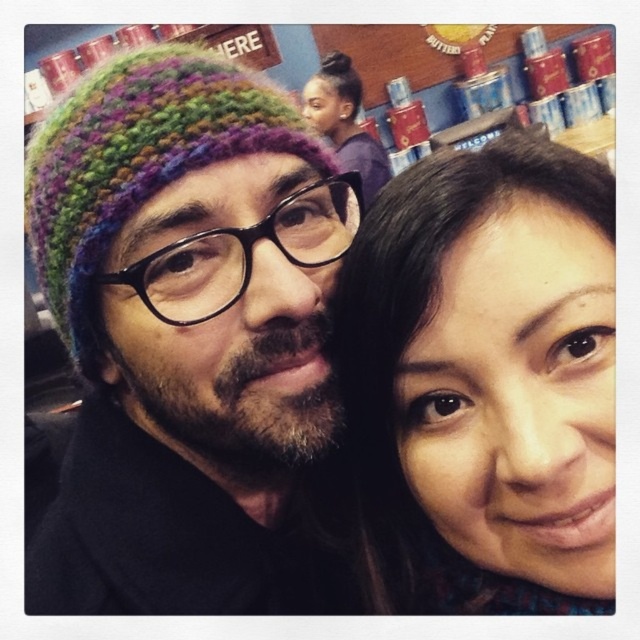
Question: Which object is the closest to the purple knit beanie at upper center?

Choices:
 (A) smooth brown hair at center
 (B) multicolored knitted hat at left

Answer: (B)

Question: Which point is farther to the camera?

Choices:
 (A) (368, 196)
 (B) (269, 483)
 (C) (548, 556)

Answer: (A)

Question: Does multicolored knitted hat at left appear under purple knit beanie at upper center?

Choices:
 (A) no
 (B) yes

Answer: (B)

Question: Which point is farther to the camera?

Choices:
 (A) smooth brown hair at center
 (B) multicolored knitted hat at left

Answer: (B)

Question: Observing the image, what is the correct spatial positioning of multicolored knitted hat at left in reference to smooth brown hair at center?

Choices:
 (A) left
 (B) right

Answer: (A)

Question: Where is multicolored knitted hat at left located in relation to purple knit beanie at upper center in the image?

Choices:
 (A) above
 (B) below

Answer: (B)